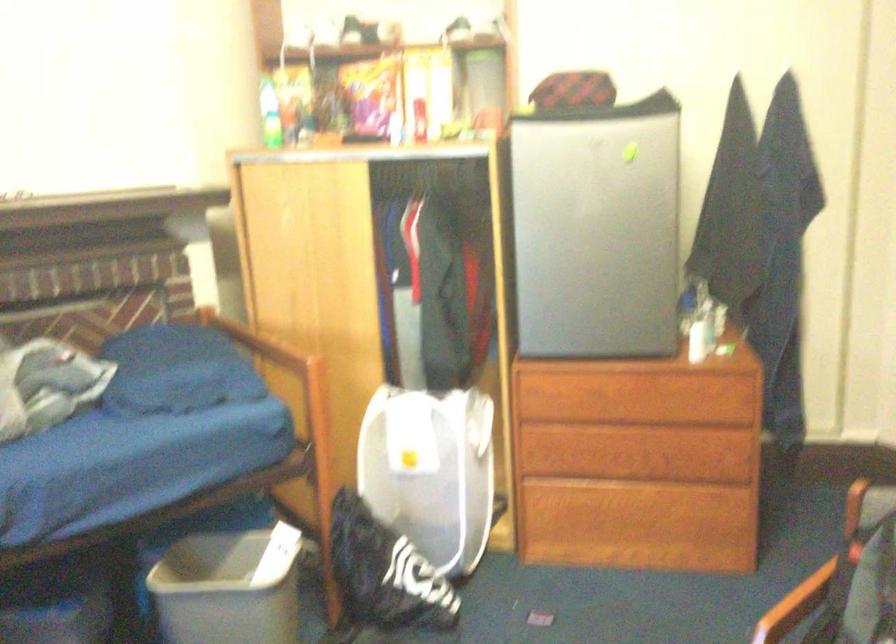
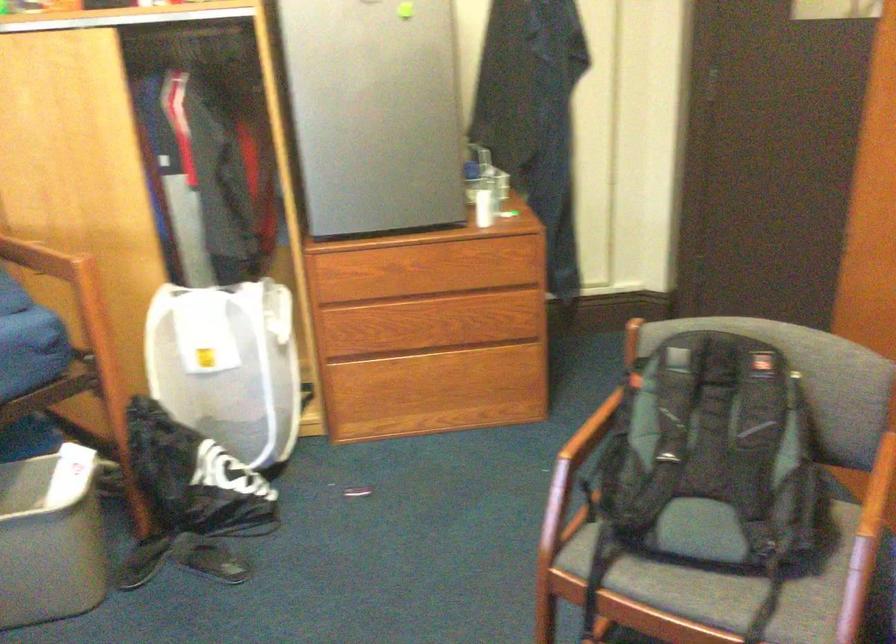
Question: The camera is either moving clockwise (left) or counter-clockwise (right) around the object. The first image is from the beginning of the video and the second image is from the end. Is the camera moving left or right when shooting the video?

Choices:
 (A) Left
 (B) Right

Answer: (A)